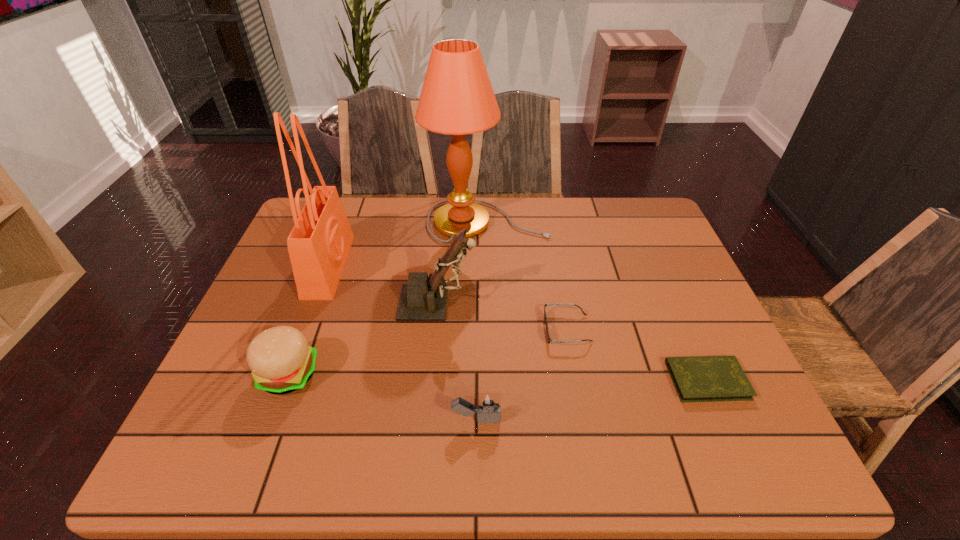
Locate an element on the screen. The height and width of the screenshot is (540, 960). tote bag that is at the left edge is located at coordinates (319, 243).

This screenshot has height=540, width=960. Find the location of `hamburger that is at the left edge`. hamburger that is at the left edge is located at coordinates (281, 361).

Where is `object at the right edge`? Image resolution: width=960 pixels, height=540 pixels. object at the right edge is located at coordinates (701, 378).

Where is `object located at the far left corner`? This screenshot has width=960, height=540. object located at the far left corner is located at coordinates (319, 243).

Where is `free space at the far edge`? This screenshot has height=540, width=960. free space at the far edge is located at coordinates (510, 233).

Image resolution: width=960 pixels, height=540 pixels. I want to click on free location at the left edge of the desktop, so click(x=277, y=407).

The image size is (960, 540). Identify the location of vacant region at the right edge. (734, 414).

Locate an element on the screen. vacant area at the far right corner of the desktop is located at coordinates (668, 233).

Where is `vacant space at the near right corner of the desktop`? Image resolution: width=960 pixels, height=540 pixels. vacant space at the near right corner of the desktop is located at coordinates (712, 450).

Find the location of `vacant area that lies between the third tallest object and the second shortest object`. vacant area that lies between the third tallest object and the second shortest object is located at coordinates (502, 316).